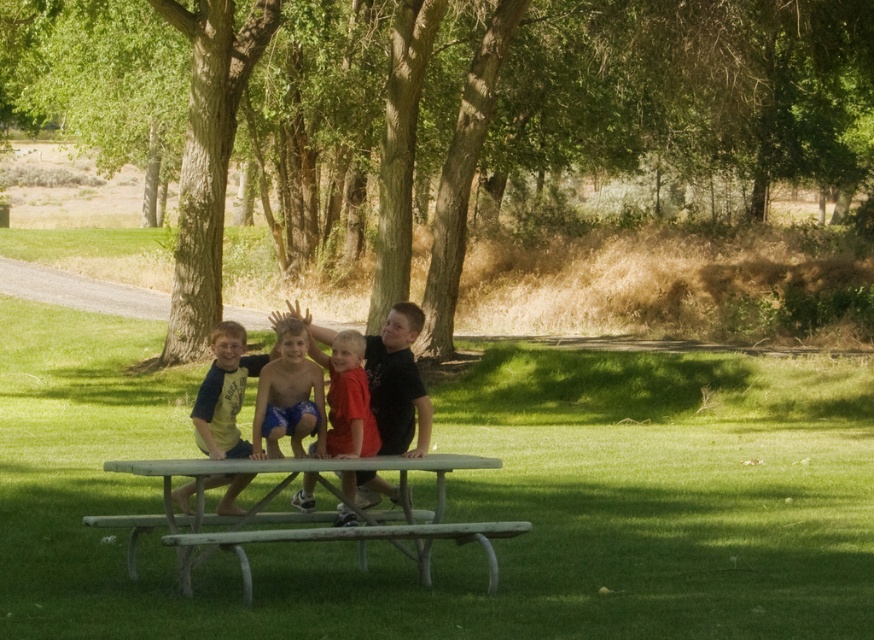
Where is `green painted wood picnic table at center`? This screenshot has height=640, width=874. green painted wood picnic table at center is located at coordinates (314, 512).

Does green painted wood picnic table at center appear on the right side of matte black shirt at center?

Correct, you'll find green painted wood picnic table at center to the right of matte black shirt at center.

Does point (399, 531) come farther from viewer compared to point (359, 492)?

No, it is in front of (359, 492).

Locate an element on the screen. This screenshot has height=640, width=874. green painted wood picnic table at center is located at coordinates (314, 512).

Does blue shorts at center appear over wooden bench at center?

Correct, blue shorts at center is located above wooden bench at center.

Which is below, blue shorts at center or wooden bench at center?

wooden bench at center

Is point (265, 384) closer to camera compared to point (320, 520)?

Yes, point (265, 384) is in front of point (320, 520).

The height and width of the screenshot is (640, 874). Identify the location of blue shorts at center. (289, 396).

Is green leafy tree at center above matte black shirt at center?

Yes, green leafy tree at center is above matte black shirt at center.

Is green leafy tree at center below matte black shirt at center?

Actually, green leafy tree at center is above matte black shirt at center.

Is point (118, 113) positioned behind point (390, 317)?

Yes, point (118, 113) is behind point (390, 317).

I want to click on green leafy tree at center, so click(x=448, y=108).